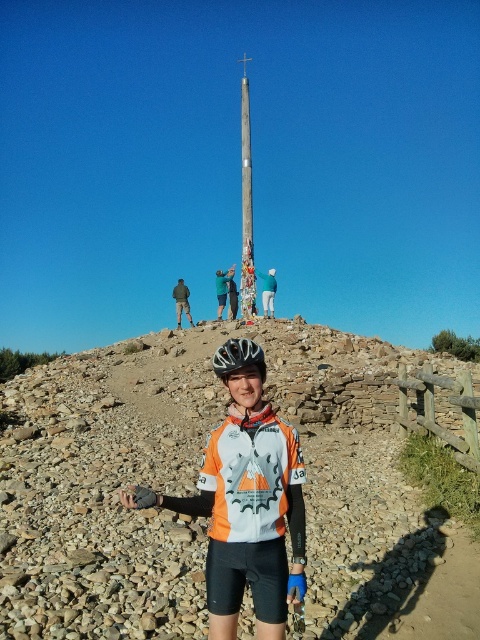
Based on the scene description, what object is located at the coordinates point (247, 509)?

The point (247, 509) corresponds to the orange jersey at center.

You are a photographer planning to take a photo of the rough stone hillside at center and the matte black helmet at center from a distance. Which object will appear larger in the photo?

The rough stone hillside at center will appear larger in the photo because it has a greater height compared to the matte black helmet at center.

You are a photographer planning to take a photo of the orange jersey at center and the wooden pole at center in the mountainous scene. Based on their sizes in the image, which object would appear closer to the camera?

The orange jersey at center appears closer to the camera because it is smaller than the wooden pole at center. In photography, objects that are smaller in the frame are typically farther away, but since the orange jersey is smaller, it might be positioned closer but with a smaller size due to perspective or camera angle. Wait, actually, in reality, larger objects in the frame are closer. Hmm, maybe I need to think again. If the orange jersey is smaller than the wooden pole but both are at center, perhaps it